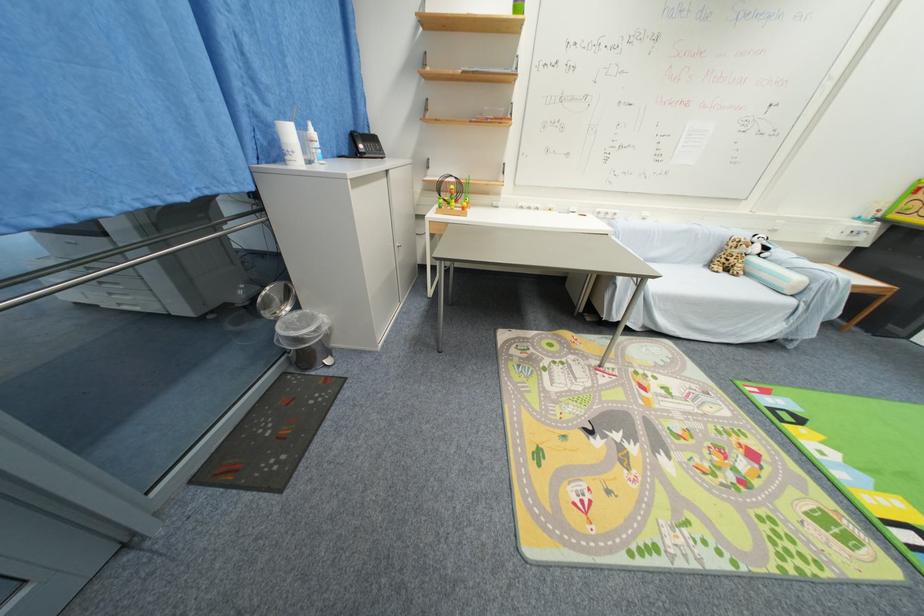
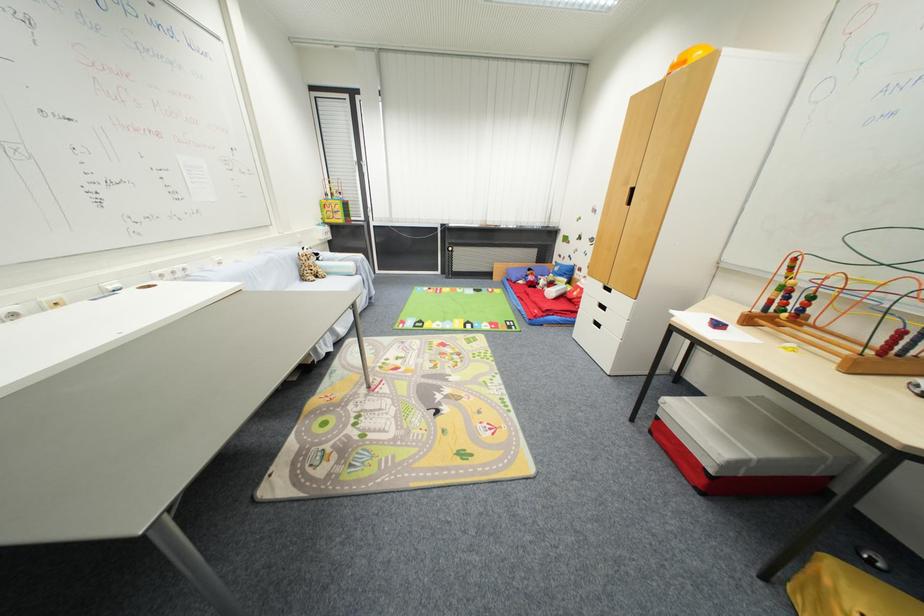
Find the pixel in the second image that matches point 732,416 in the first image.

(423, 342)